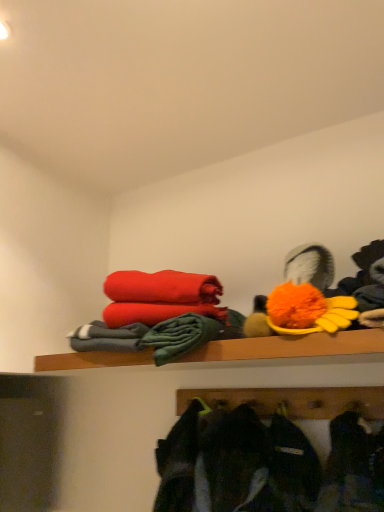
Question: Can you confirm if wooden shelf at upper center is smaller than dark gray fabric jacket at lower center?

Choices:
 (A) no
 (B) yes

Answer: (B)

Question: Does wooden shelf at upper center have a greater width compared to dark gray fabric jacket at lower center?

Choices:
 (A) no
 (B) yes

Answer: (A)

Question: Would you say dark gray fabric jacket at lower center is part of wooden shelf at upper center's contents?

Choices:
 (A) yes
 (B) no

Answer: (B)

Question: Can you confirm if wooden shelf at upper center is positioned to the left of dark gray fabric jacket at lower center?

Choices:
 (A) yes
 (B) no

Answer: (A)

Question: Is wooden shelf at upper center oriented away from dark gray fabric jacket at lower center?

Choices:
 (A) yes
 (B) no

Answer: (B)

Question: In the image, is wooden shelf at upper center on the left side or the right side of fluffy orange pom-pom at upper right?

Choices:
 (A) left
 (B) right

Answer: (A)

Question: Is point (375, 346) closer or farther from the camera than point (268, 320)?

Choices:
 (A) closer
 (B) farther

Answer: (A)

Question: From the image's perspective, is wooden shelf at upper center positioned above or below fluffy orange pom-pom at upper right?

Choices:
 (A) below
 (B) above

Answer: (A)

Question: Is wooden shelf at upper center inside or outside of fluffy orange pom-pom at upper right?

Choices:
 (A) outside
 (B) inside

Answer: (A)

Question: Is point (291, 271) closer or farther from the camera than point (114, 359)?

Choices:
 (A) farther
 (B) closer

Answer: (B)

Question: In the image, is fluffy orange pom-pom at upper right on the left side or the right side of wooden shelf at upper center?

Choices:
 (A) left
 (B) right

Answer: (B)

Question: Is fluffy orange pom-pom at upper right taller or shorter than wooden shelf at upper center?

Choices:
 (A) short
 (B) tall

Answer: (B)

Question: Considering their positions, is fluffy orange pom-pom at upper right located in front of or behind wooden shelf at upper center?

Choices:
 (A) behind
 (B) front

Answer: (A)

Question: From the image's perspective, is dark gray fabric jacket at lower center above or below wooden shelf at upper center?

Choices:
 (A) below
 (B) above

Answer: (A)

Question: Is dark gray fabric jacket at lower center bigger or smaller than wooden shelf at upper center?

Choices:
 (A) small
 (B) big

Answer: (B)